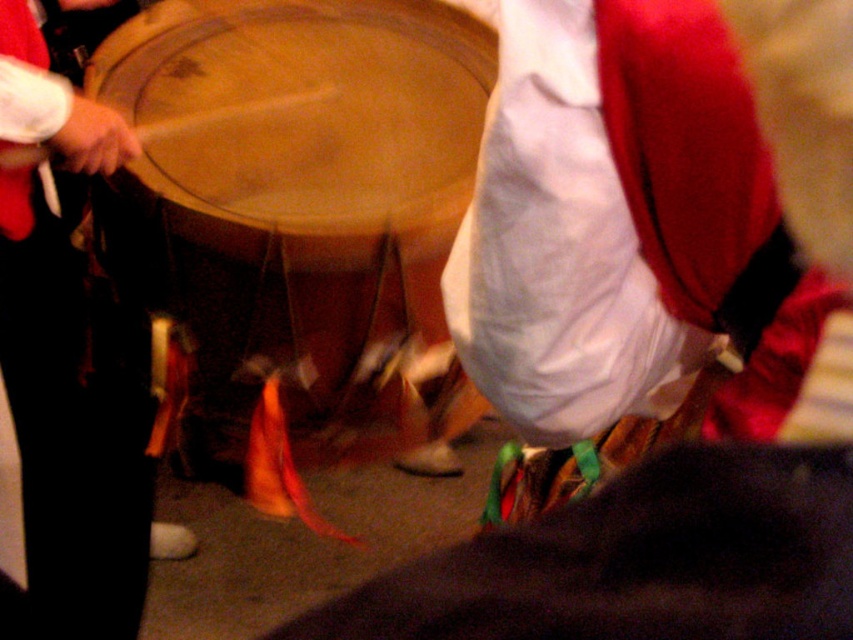
Question: Which point is farther to the camera?

Choices:
 (A) (195, 454)
 (B) (35, 248)

Answer: (A)

Question: Is wooden drum at center to the left of matte black drum at center from the viewer's perspective?

Choices:
 (A) no
 (B) yes

Answer: (A)

Question: Does wooden drum at center appear on the left side of matte black drum at center?

Choices:
 (A) yes
 (B) no

Answer: (B)

Question: Which of the following is the closest to the observer?

Choices:
 (A) (25, 300)
 (B) (334, 253)

Answer: (B)

Question: Is wooden drum at center positioned before matte black drum at center?

Choices:
 (A) no
 (B) yes

Answer: (A)